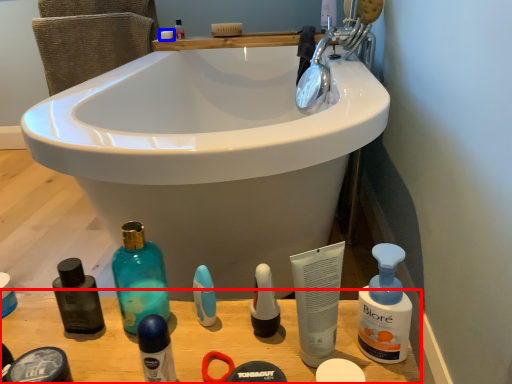
Question: Which point is further to the camera, counter top (highlighted by a red box) or soap (highlighted by a blue box)?

Choices:
 (A) counter top
 (B) soap

Answer: (B)